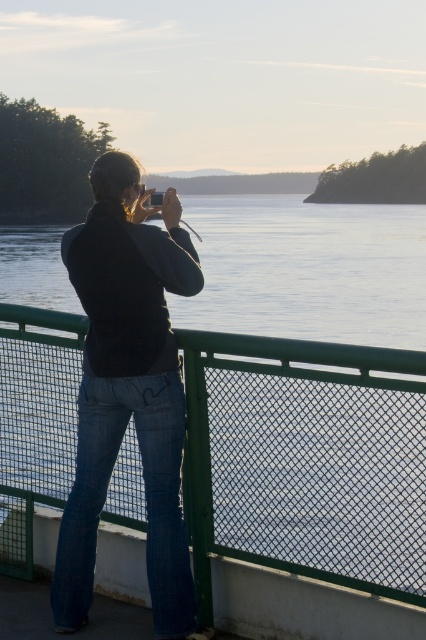
You are standing on the deck and want to take a photo of the water without any obstructions. The green mesh fence at center and denim jeans at center are in your way. Which object should you move to the left to clear your view?

You should move the denim jeans at center to the left because the green mesh fence at center is already to the right of the denim jeans at center, so moving the jeans left would remove the obstruction.

You are standing on the deck and want to take a photo of the green mesh fence at center. Where should you aim your camera to capture it?

You should aim your camera at point (305, 460) to capture the green mesh fence at center.